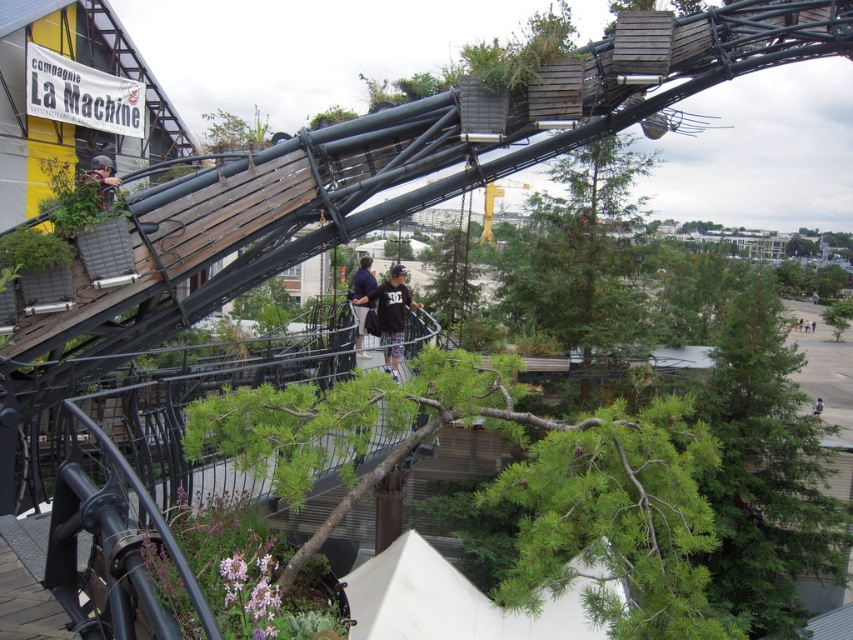
Question: Does black cotton shirt at center appear under dark blue shirt at center?

Choices:
 (A) no
 (B) yes

Answer: (B)

Question: Is green textured tree at upper right to the right of dark blue jeans at center from the viewer's perspective?

Choices:
 (A) no
 (B) yes

Answer: (A)

Question: Which is farther from the black cotton shirt at center?

Choices:
 (A) dark blue shirt at center
 (B) dark blue jeans at center
 (C) matte black helmet at upper left
 (D) green textured tree at upper right

Answer: (B)

Question: Which point is closer to the camera?

Choices:
 (A) black cotton shirt at center
 (B) green textured tree at upper right

Answer: (A)

Question: Can you confirm if green textured tree at upper right is wider than black cotton shirt at center?

Choices:
 (A) yes
 (B) no

Answer: (A)

Question: Considering the real-world distances, which object is closest to the matte black helmet at upper left?

Choices:
 (A) black cotton shirt at center
 (B) dark blue shirt at center
 (C) green textured tree at upper right

Answer: (A)